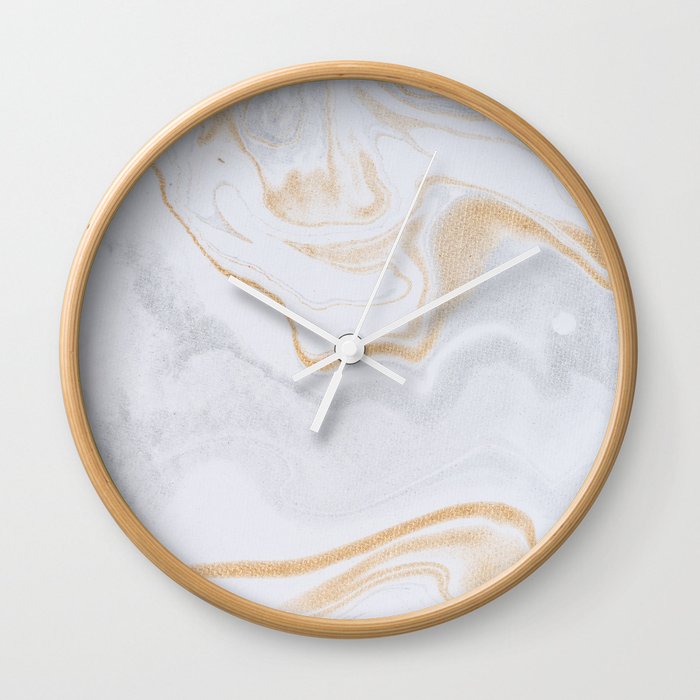
The image size is (700, 700). In order to click on blank wall in this screenshot , I will do `click(92, 47)`.